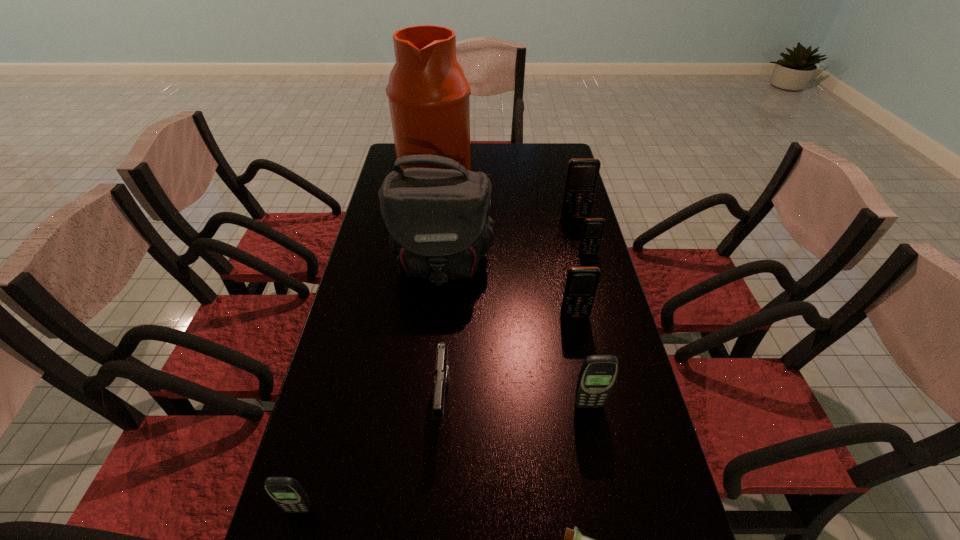
This screenshot has height=540, width=960. What are the coordinates of `orange cellular telephone object that ranks as the second closest to the third nearest cellular telephone` in the screenshot? It's located at (582, 174).

Identify the location of free spot that satisfies the following two spatial constraints: 1. from the spout of the orange water jug; 2. on the screen of the left gray cellular telephone. (393, 509).